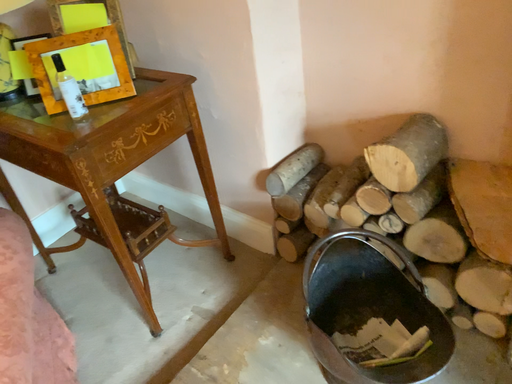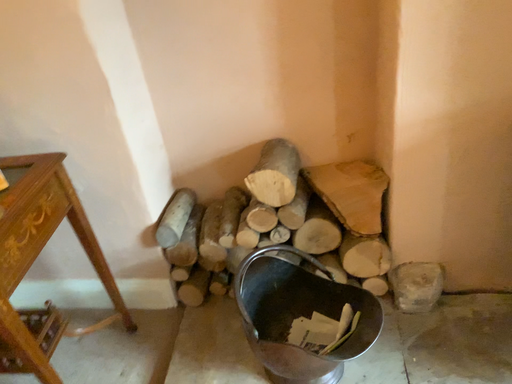
Question: How did the camera likely rotate when shooting the video?

Choices:
 (A) rotated upward
 (B) rotated downward

Answer: (A)